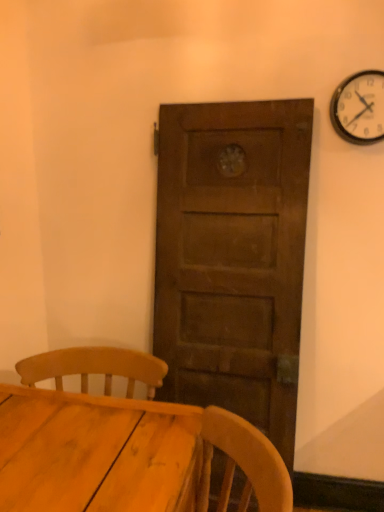
Question: Considering the relative sizes of metallic silver clock at upper right and wooden table at lower left in the image provided, is metallic silver clock at upper right taller than wooden table at lower left?

Choices:
 (A) yes
 (B) no

Answer: (B)

Question: Would you say metallic silver clock at upper right is outside wooden table at lower left?

Choices:
 (A) yes
 (B) no

Answer: (A)

Question: Can you confirm if metallic silver clock at upper right is bigger than wooden table at lower left?

Choices:
 (A) no
 (B) yes

Answer: (A)

Question: From the image's perspective, would you say metallic silver clock at upper right is positioned over wooden table at lower left?

Choices:
 (A) yes
 (B) no

Answer: (A)

Question: Does metallic silver clock at upper right have a lesser height compared to wooden table at lower left?

Choices:
 (A) yes
 (B) no

Answer: (A)

Question: Does metallic silver clock at upper right have a smaller size compared to wooden table at lower left?

Choices:
 (A) yes
 (B) no

Answer: (A)

Question: Does wooden table at lower left have a lesser width compared to metallic silver clock at upper right?

Choices:
 (A) yes
 (B) no

Answer: (B)

Question: Considering the relative positions of wooden table at lower left and metallic silver clock at upper right in the image provided, is wooden table at lower left behind metallic silver clock at upper right?

Choices:
 (A) no
 (B) yes

Answer: (A)

Question: Is wooden table at lower left aimed at metallic silver clock at upper right?

Choices:
 (A) no
 (B) yes

Answer: (A)

Question: From the image's perspective, is wooden table at lower left on metallic silver clock at upper right?

Choices:
 (A) no
 (B) yes

Answer: (A)

Question: Is wooden table at lower left closer to the viewer compared to metallic silver clock at upper right?

Choices:
 (A) no
 (B) yes

Answer: (B)

Question: Is wooden table at lower left taller than metallic silver clock at upper right?

Choices:
 (A) no
 (B) yes

Answer: (B)

Question: Is point (375, 139) closer or farther from the camera than point (87, 467)?

Choices:
 (A) closer
 (B) farther

Answer: (B)